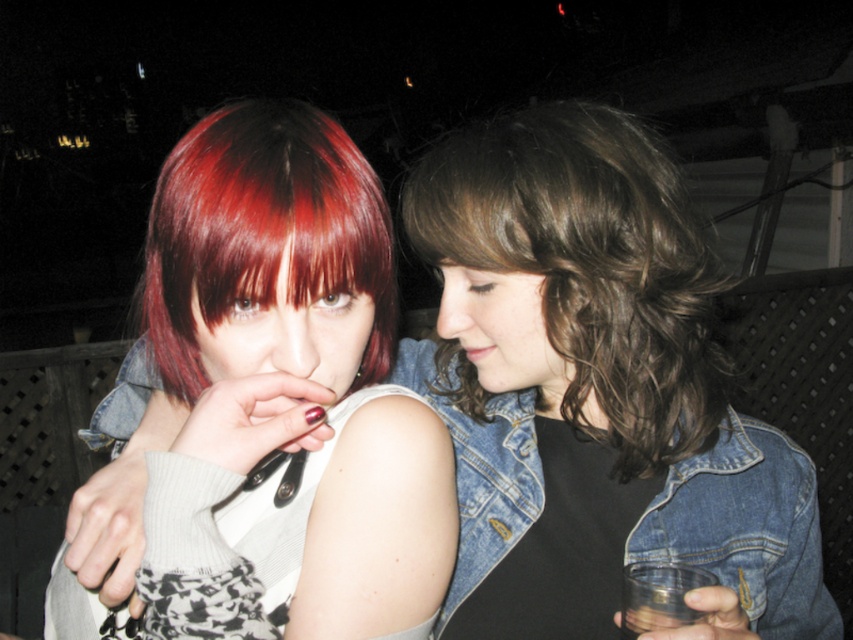
Who is more forward, (x=456, y=344) or (x=643, y=566)?

Point (x=643, y=566) is in front.

I want to click on brown wavy hair at center, so click(x=589, y=266).

Which is behind, point (579, 188) or point (659, 605)?

Point (579, 188)

The height and width of the screenshot is (640, 853). What are the coordinates of `brown wavy hair at center` in the screenshot? It's located at (589, 266).

Is matte red hair at center positioned in front of transparent plastic cup at lower right?

Yes, it is in front of transparent plastic cup at lower right.

Which is more to the right, matte red hair at center or transparent plastic cup at lower right?

transparent plastic cup at lower right is more to the right.

The image size is (853, 640). Describe the element at coordinates (283, 396) in the screenshot. I see `matte red hair at center` at that location.

Identify the location of matte red hair at center. The height and width of the screenshot is (640, 853). (283, 396).

Who is positioned more to the right, matte red hair at center or shiny red hair at center?

matte red hair at center is more to the right.

Does matte red hair at center have a smaller size compared to shiny red hair at center?

Actually, matte red hair at center might be larger than shiny red hair at center.

Is point (196, 429) behind point (238, 193)?

That is True.

Locate an element on the screen. matte red hair at center is located at coordinates (283, 396).